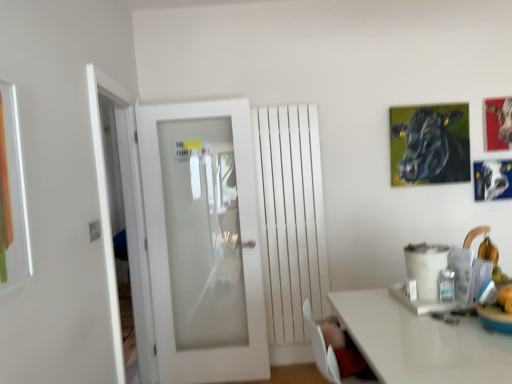
Question: Looking at their shapes, would you say white frosted glass door at center is wider or thinner than white frosted glass door at left?

Choices:
 (A) thin
 (B) wide

Answer: (B)

Question: From the image's perspective, relative to white frosted glass door at left, is white frosted glass door at center above or below?

Choices:
 (A) above
 (B) below

Answer: (A)

Question: Which object is positioned closest to the oil painting cow at upper right, which appears as the third picture frame when viewed from the right?

Choices:
 (A) metallic silver picture frame at upper right, which is counted as the third picture frame, starting from the left
 (B) white frosted glass door at center
 (C) metallic silver picture frame at upper right, acting as the second picture frame starting from the left
 (D) white matte radiator at center
 (E) white frosted glass door at left

Answer: (C)

Question: Which of these objects is positioned closest to the white matte radiator at center?

Choices:
 (A) oil painting cow at upper right, which is the 1th picture frame from left to right
 (B) white frosted glass door at left
 (C) metallic silver picture frame at upper right, acting as the 2th picture frame starting from the right
 (D) metallic silver picture frame at upper right, arranged as the first picture frame when viewed from the right
 (E) white frosted glass door at center

Answer: (E)